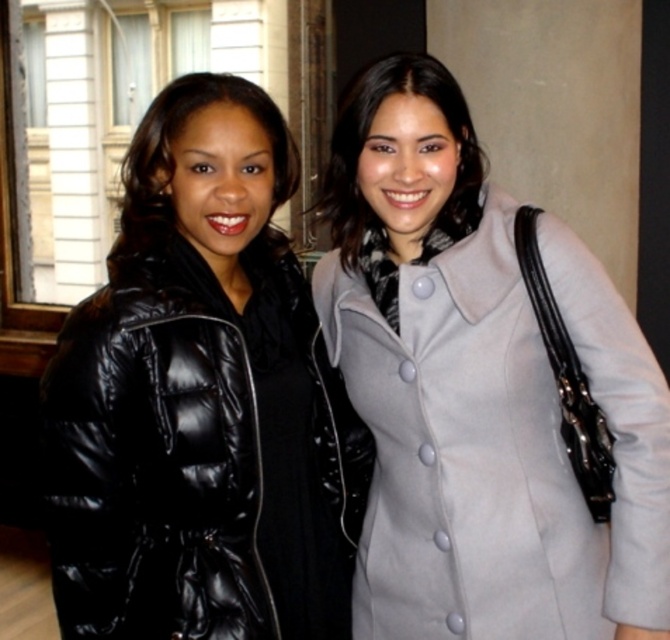
You are a photographer trying to adjust the lighting for a photo shoot. You notice the black puffy coat at left and the matte black coat at center are casting shadows. Which coat is closer to the light source based on their positions?

The black puffy coat at left is closer to the light source because it is positioned to the left of the matte black coat at center, which is further away.

You are a photographer trying to capture a closeup of the light gray wool coat at center and the matte black coat at center. Since you can only focus on one coat at a time, which one should you focus on first if you want to ensure the closest subject is sharp?

The light gray wool coat at center is to the right of matte black coat at center, but since both are at the same center position, their distance from the camera is similar. However, focusing on the matte black coat at center first would ensure the closest subject is sharp if the light gray wool coat is slightly farther due to being positioned to the right.